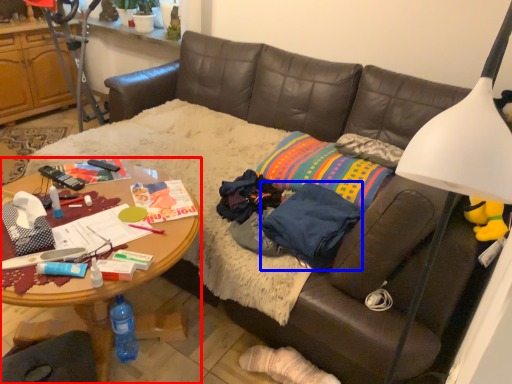
Question: Which point is closer to the camera, desk (highlighted by a red box) or clothing (highlighted by a blue box)?

Choices:
 (A) desk
 (B) clothing

Answer: (A)